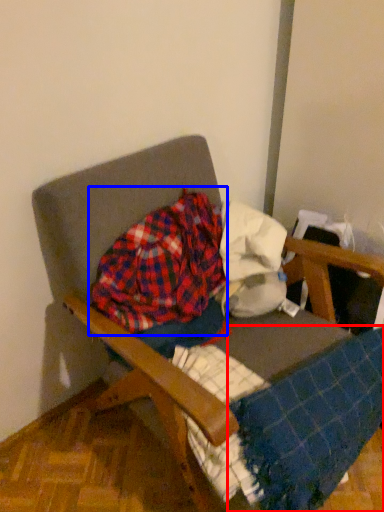
Question: Which object is further to the camera taking this photo, blanket (highlighted by a red box) or flannel (highlighted by a blue box)?

Choices:
 (A) blanket
 (B) flannel

Answer: (B)